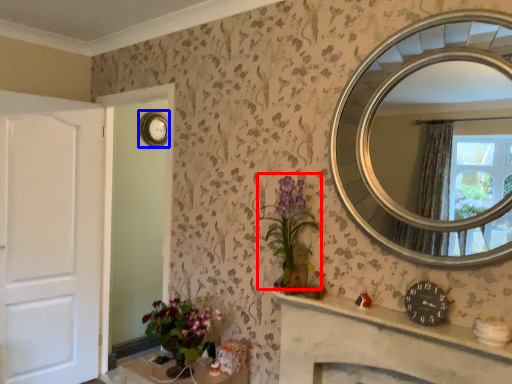
Question: Among these objects, which one is nearest to the camera, floral arrangement (highlighted by a red box) or clock (highlighted by a blue box)?

Choices:
 (A) floral arrangement
 (B) clock

Answer: (A)